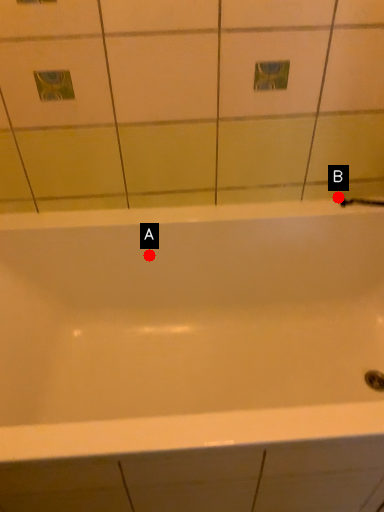
Question: Two points are circled on the image, labeled by A and B beside each circle. Which of the following is the farthest from the observer?

Choices:
 (A) A is further
 (B) B is further

Answer: (B)